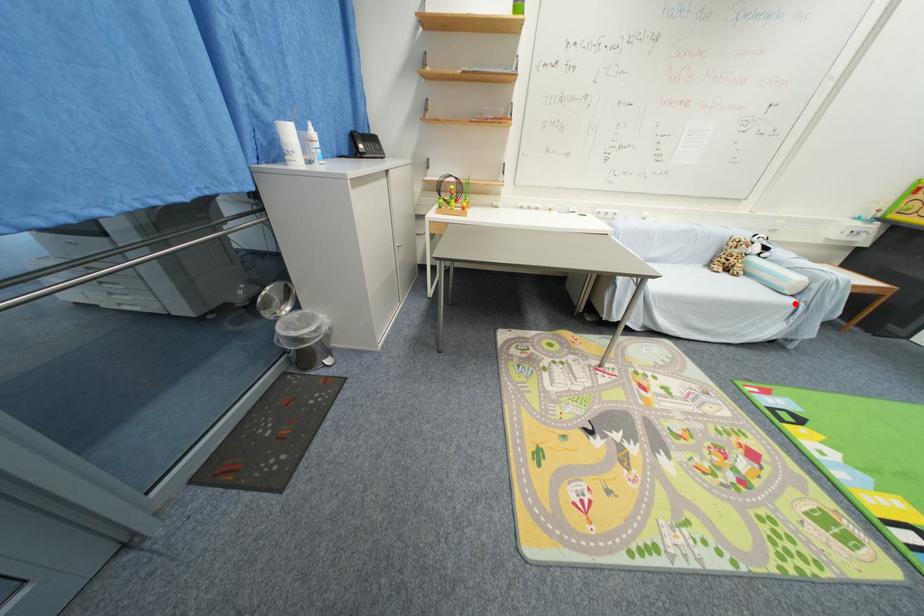
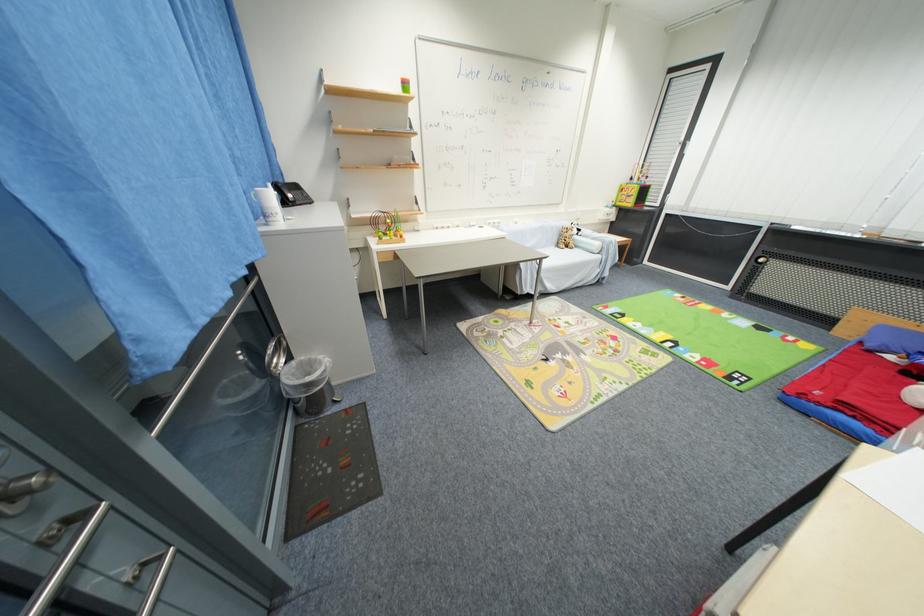
Where in the second image is the point corresponding to the highlighted location from the first image?

(603, 259)